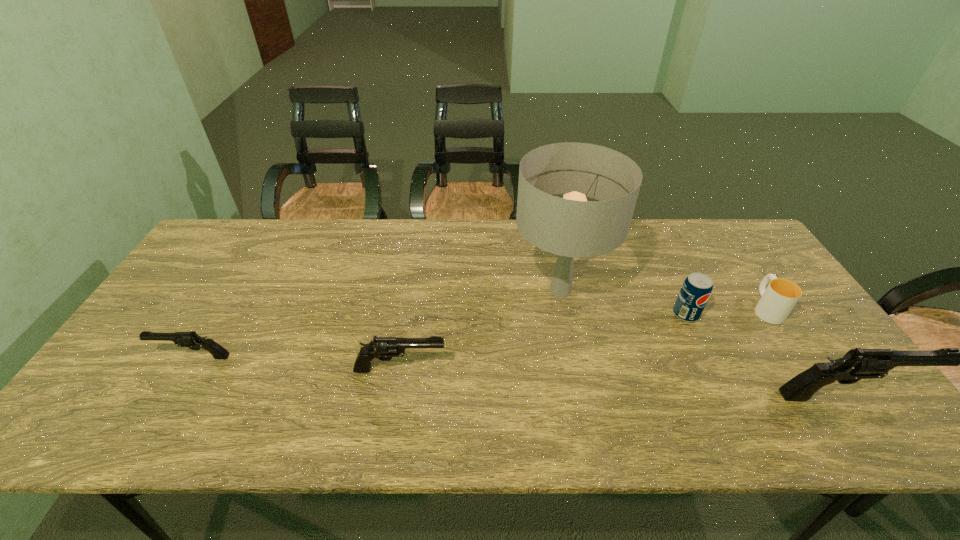
If the aim is uniform spacing by inserting an additional gun among them, please point to a vacant space for this new gun. Please provide its 2D coordinates. Your answer should be formatted as a tuple, i.e. [(x, y)], where the tuple contains the x and y coordinates of a point satisfying the conditions above.

[(618, 382)]